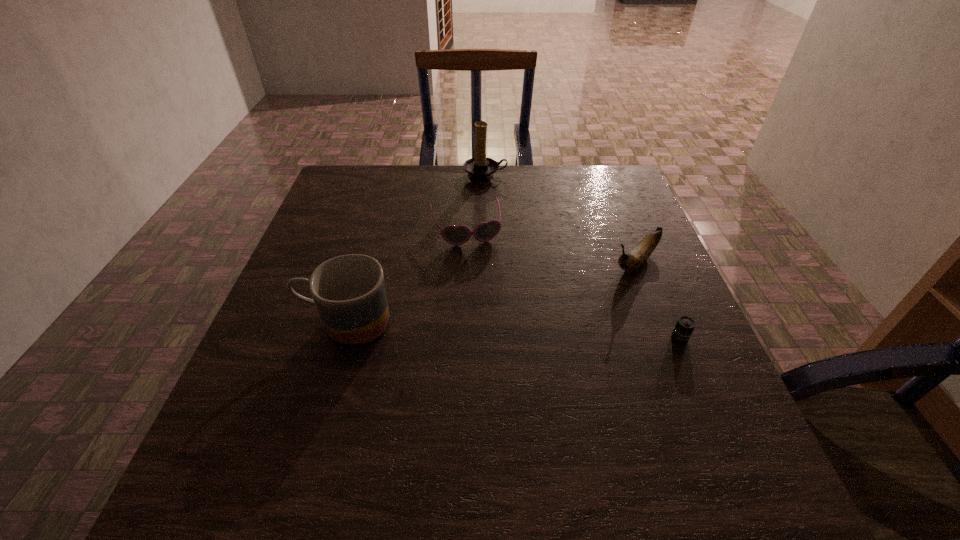
Locate an element on the screen. Image resolution: width=960 pixels, height=540 pixels. free spot on the desktop that is between the fourth shortest object and the beer can and is positioned on the front-facing side of the second shortest object is located at coordinates (494, 330).

Identify the location of vacant space on the desktop that is between the leftmost object and the shortest object and is positioned on the wick of the farthest object. (543, 332).

Where is `free spot on the desktop that is between the leftmost object and the beer can and is positioned at the stem of the banana`? free spot on the desktop that is between the leftmost object and the beer can and is positioned at the stem of the banana is located at coordinates (558, 333).